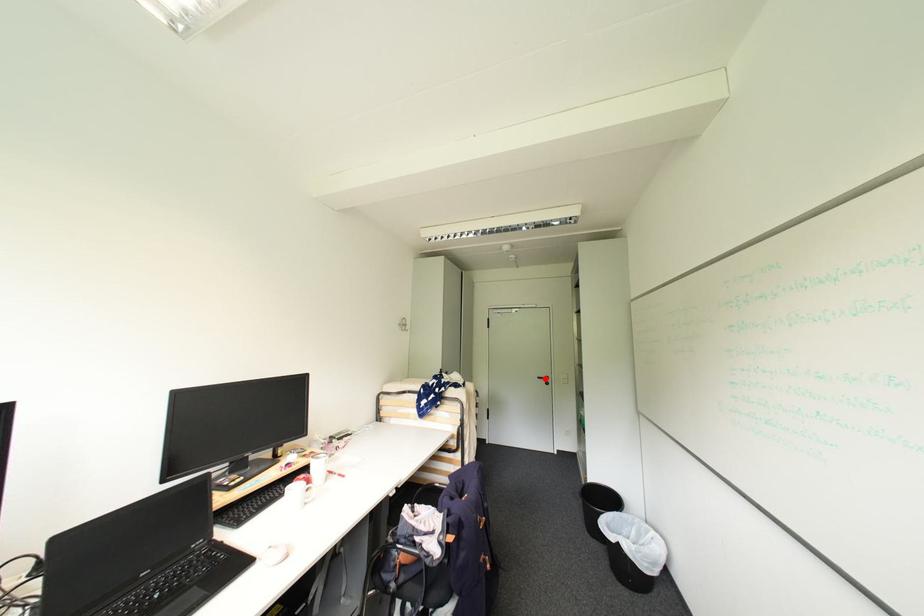
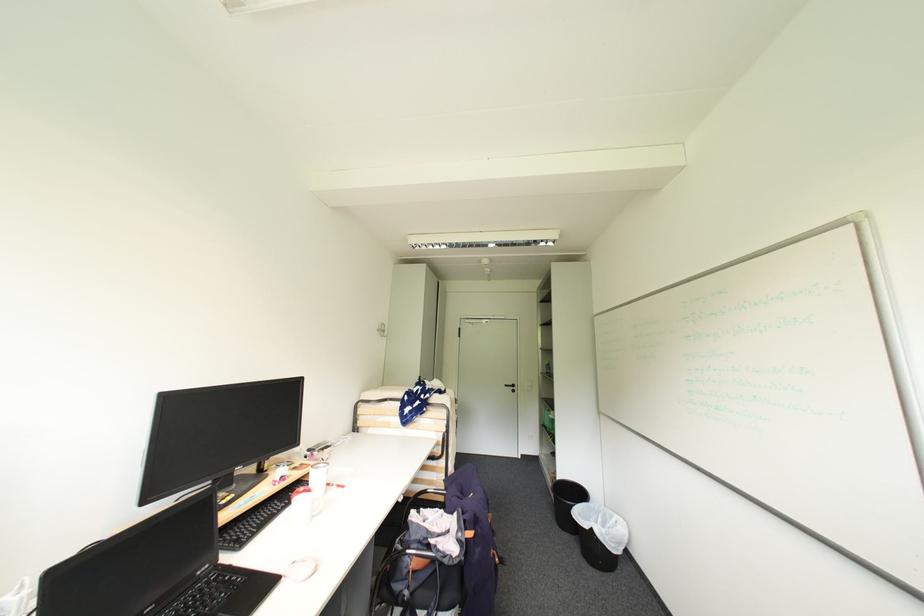
Where in the second image is the point corresponding to the highlighted location from the first image?

(513, 387)